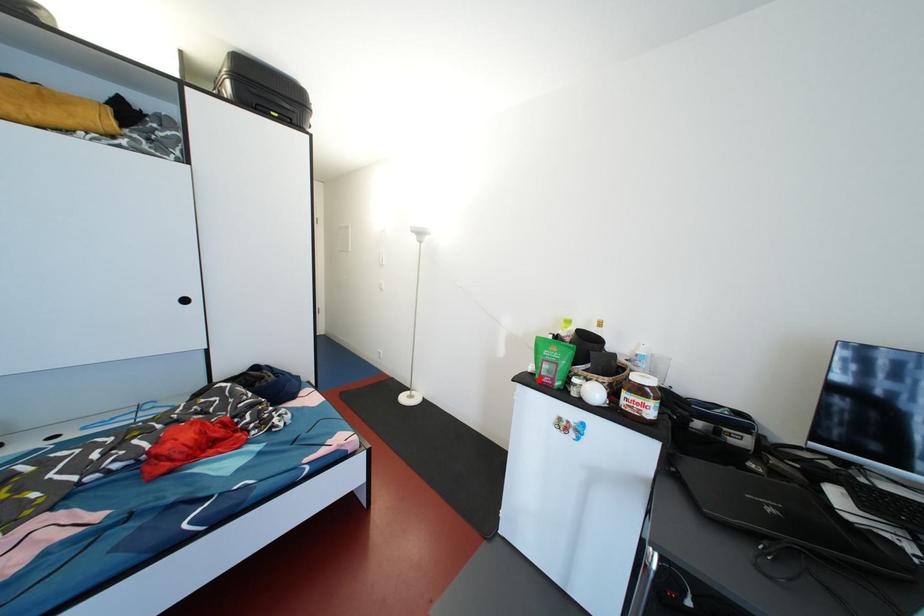
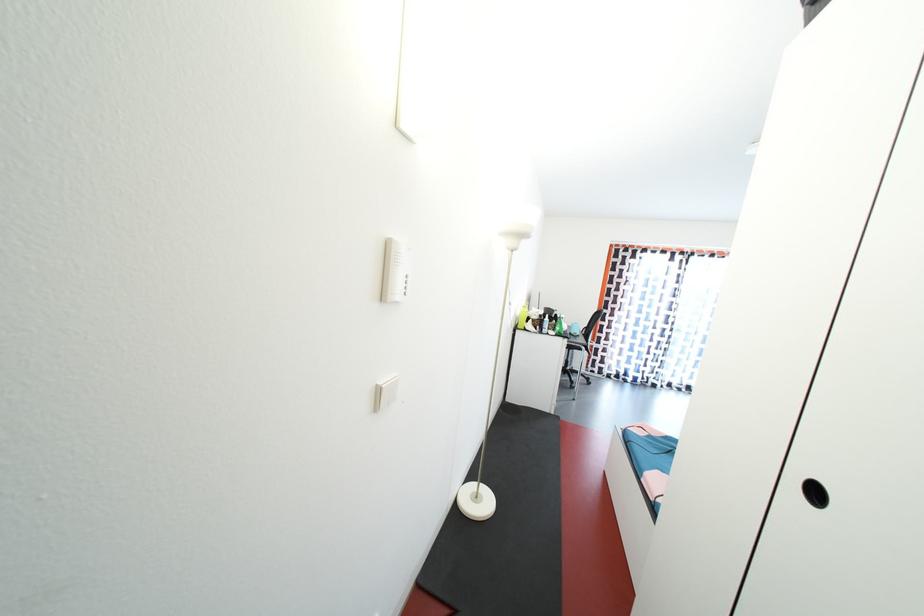
Question: I am providing you with two images of the same scene from different viewpoints. A red point is marked on the first image. Is the red point's position out of view in image 2?

Choices:
 (A) Yes
 (B) No

Answer: (A)